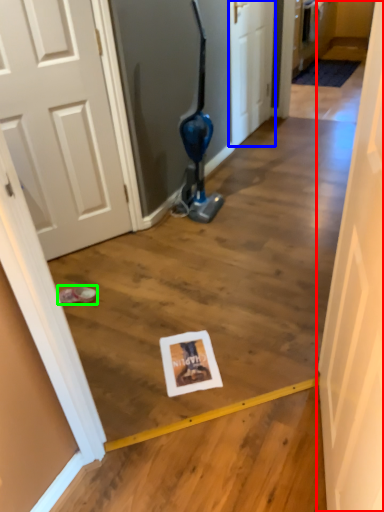
Question: Which object is positioned farthest from door (highlighted by a red box)? Select from door (highlighted by a blue box) and footwear (highlighted by a green box).

Choices:
 (A) door
 (B) footwear

Answer: (A)